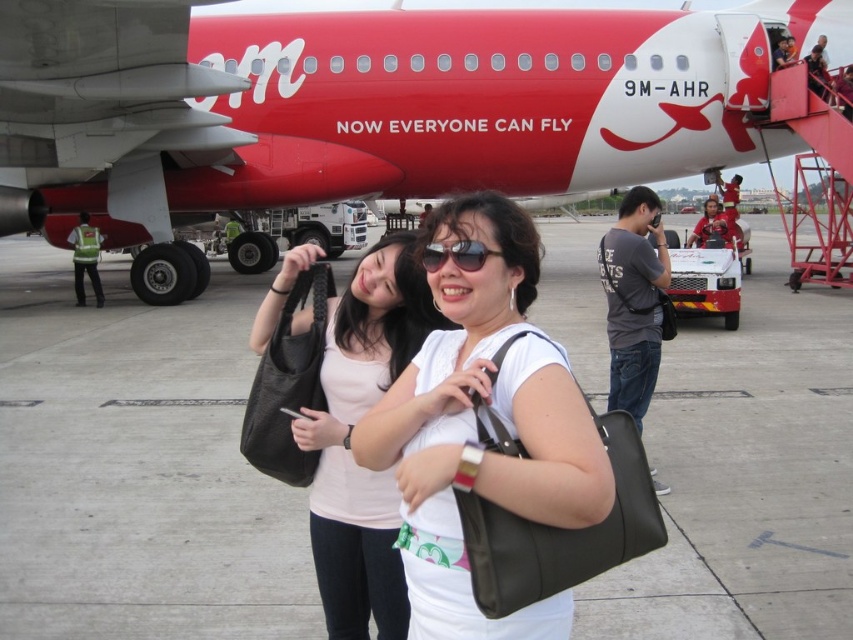
Consider the image. Measure the distance from gray fabric camera bag at right to sunglasses at center.

They are 10.12 feet apart.

Can you confirm if gray fabric camera bag at right is wider than sunglasses at center?

Yes.

Is point (651, 468) positioned in front of point (469, 268)?

No, it is not.

Find the location of a particular element. Image resolution: width=853 pixels, height=640 pixels. gray fabric camera bag at right is located at coordinates (634, 300).

Does white matte shirt at center have a greater width compared to sunglasses at center?

Correct, the width of white matte shirt at center exceeds that of sunglasses at center.

Which is more to the right, white matte shirt at center or sunglasses at center?

From the viewer's perspective, sunglasses at center appears more on the right side.

Is point (416, 536) less distant than point (426, 253)?

Yes, point (416, 536) is in front of point (426, 253).

Where is `white matte shirt at center`? The height and width of the screenshot is (640, 853). white matte shirt at center is located at coordinates (474, 428).

Who is positioned more to the right, white matte shirt at center or matte black bag at center?

Positioned to the right is white matte shirt at center.

Is white matte shirt at center to the left of matte black bag at center from the viewer's perspective?

In fact, white matte shirt at center is to the right of matte black bag at center.

Locate an element on the screen. The image size is (853, 640). white matte shirt at center is located at coordinates (474, 428).

This screenshot has width=853, height=640. Identify the location of white matte shirt at center. (474, 428).